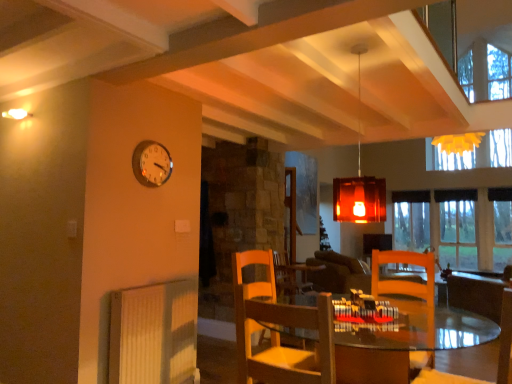
Measure the distance between wooden chair at center, the first chair positioned from the left, and camera.

A distance of 4.96 feet exists between wooden chair at center, the first chair positioned from the left, and camera.

Describe the element at coordinates (151, 163) in the screenshot. I see `white glossy clock at upper left` at that location.

Image resolution: width=512 pixels, height=384 pixels. Describe the element at coordinates (154, 334) in the screenshot. I see `white ribbed radiator at lower left` at that location.

You are a GUI agent. You are given a task and a screenshot of the screen. Output one action in this format:
    pyautogui.click(x=<x>, y=<y>)
    Task: Click on the wooden chair at center, the first chair positioned from the left
    This screenshot has height=384, width=512.
    Given the screenshot: What is the action you would take?
    pyautogui.click(x=278, y=332)

Considering the positions of point (254, 373) and point (339, 264), is point (254, 373) closer or farther from the camera than point (339, 264)?

Point (254, 373) is positioned closer to the camera compared to point (339, 264).

From a real-world perspective, is wooden chair at center, the first chair positioned from the left, physically located above or below dark brown leather couch at center?

Clearly, from a real-world perspective, wooden chair at center, the first chair positioned from the left, is above dark brown leather couch at center.

Is wooden chair at center, the first chair positioned from the left, oriented away from dark brown leather couch at center?

No, wooden chair at center, the first chair positioned from the left,'s orientation is not away from dark brown leather couch at center.

Does wooden chair at center, the 2th chair positioned from the right, have a smaller size compared to dark brown leather couch at center?

Indeed, wooden chair at center, the 2th chair positioned from the right, has a smaller size compared to dark brown leather couch at center.

Is wooden table at center smaller than dark brown leather couch at center?

Indeed, wooden table at center has a smaller size compared to dark brown leather couch at center.

From the image's perspective, is wooden table at center over dark brown leather couch at center?

Yes.

From a real-world perspective, who is located lower, wooden table at center or dark brown leather couch at center?

In real-world perspective, dark brown leather couch at center is lower.

Locate an element on the screen. the 1st chair in front of the translucent amber glass pendant light at center is located at coordinates (498, 358).

How many degrees apart are the facing directions of wooden chair at lower right, acting as the 1th chair starting from the right, and translucent amber glass pendant light at center?

87.2 degrees.

From a real-world perspective, is wooden chair at lower right, acting as the second chair starting from the left, physically below translucent amber glass pendant light at center?

Yes, from a real-world perspective, wooden chair at lower right, acting as the second chair starting from the left, is beneath translucent amber glass pendant light at center.

From the image's perspective, between wooden chair at lower right, acting as the second chair starting from the left, and translucent amber glass pendant light at center, who is located below?

wooden chair at lower right, acting as the second chair starting from the left.

Do you think dark brown leather couch at center is within wooden chair at center, the first chair positioned from the left, or outside of it?

dark brown leather couch at center is not enclosed by wooden chair at center, the first chair positioned from the left.

Can you confirm if dark brown leather couch at center is bigger than wooden chair at center, the 2th chair positioned from the right?

Yes.

Is dark brown leather couch at center oriented away from wooden chair at center, the 2th chair positioned from the right?

dark brown leather couch at center does not have its back to wooden chair at center, the 2th chair positioned from the right.

In the scene shown: Is dark brown leather couch at center far away from wooden chair at center, the 2th chair positioned from the right?

Absolutely, dark brown leather couch at center is distant from wooden chair at center, the 2th chair positioned from the right.

Where is `radiator below the white glossy clock at upper left (from a real-world perspective)`? radiator below the white glossy clock at upper left (from a real-world perspective) is located at coordinates (154, 334).

Is white glossy clock at upper left completely or partially inside white ribbed radiator at lower left?

That's incorrect, white glossy clock at upper left is not inside white ribbed radiator at lower left.

Which is more to the right, white ribbed radiator at lower left or white glossy clock at upper left?

From the viewer's perspective, white ribbed radiator at lower left appears more on the right side.

Can you confirm if white ribbed radiator at lower left is wider than white glossy clock at upper left?

Correct, the width of white ribbed radiator at lower left exceeds that of white glossy clock at upper left.

Is wooden chair at center, the first chair positioned from the left, facing towards wooden chair at lower right, acting as the second chair starting from the left?

No, wooden chair at center, the first chair positioned from the left, is not oriented towards wooden chair at lower right, acting as the second chair starting from the left.

Does point (298, 356) appear closer or farther from the camera than point (480, 382)?

Point (298, 356) appears to be closer to the viewer than point (480, 382).

Is wooden chair at center, the first chair positioned from the left, taller or shorter than wooden chair at lower right, acting as the 1th chair starting from the right?

In the image, wooden chair at center, the first chair positioned from the left, appears to be shorter than wooden chair at lower right, acting as the 1th chair starting from the right.

Can you see wooden chair at center, the first chair positioned from the left, touching wooden chair at lower right, acting as the second chair starting from the left?

No, wooden chair at center, the first chair positioned from the left, is not with wooden chair at lower right, acting as the second chair starting from the left.

This screenshot has width=512, height=384. Find the location of `radiator on the left side of clear glass window at center`. radiator on the left side of clear glass window at center is located at coordinates (154, 334).

Is clear glass window at center not close to white ribbed radiator at lower left?

clear glass window at center is far away from white ribbed radiator at lower left.

Is clear glass window at center located outside white ribbed radiator at lower left?

clear glass window at center is positioned outside white ribbed radiator at lower left.

The width and height of the screenshot is (512, 384). I want to click on couch on the right of the wooden chair at center, the 2th chair positioned from the right, so click(339, 273).

This screenshot has width=512, height=384. In order to click on table above the dark brown leather couch at center (from a real-world perspective) in this screenshot , I will do `click(406, 342)`.

Which object lies nearer to the anchor point white ribbed radiator at lower left, translucent amber glass pendant light at center or clear glass window at center?

translucent amber glass pendant light at center.

Looking at the image, which one is located further to wooden chair at center, the first chair positioned from the left, dark brown leather couch at center or white glossy clock at upper left?

dark brown leather couch at center.

When comparing their distances from white ribbed radiator at lower left, does wooden chair at lower right, acting as the 1th chair starting from the right, or clear glass window at center seem further?

Among the two, clear glass window at center is located further to white ribbed radiator at lower left.

When comparing their distances from dark brown leather couch at center, does white glossy clock at upper left or white ribbed radiator at lower left seem closer?

white ribbed radiator at lower left.

Considering their positions, is translucent amber glass pendant light at center positioned closer to wooden table at center than clear glass window at center?

clear glass window at center is positioned closer to the anchor wooden table at center.

From the image, which object appears to be nearer to clear glass window at center, wooden chair at lower right, acting as the 1th chair starting from the right, or white glossy clock at upper left?

wooden chair at lower right, acting as the 1th chair starting from the right, is closer to clear glass window at center.

When comparing their distances from wooden table at center, does translucent amber glass pendant light at center or white ribbed radiator at lower left seem further?

Among the two, translucent amber glass pendant light at center is located further to wooden table at center.

Estimate the real-world distances between objects in this image. Which object is further from wooden chair at center, the first chair positioned from the left, white ribbed radiator at lower left or clear glass window at center?

Among the two, clear glass window at center is located further to wooden chair at center, the first chair positioned from the left.

You are a GUI agent. You are given a task and a screenshot of the screen. Output one action in this format:
    pyautogui.click(x=<x>, y=<y>)
    Task: Click on the clock positioned between translucent amber glass pendant light at center and dark brown leather couch at center from near to far
    
    Given the screenshot: What is the action you would take?
    pyautogui.click(x=151, y=163)

You are a GUI agent. You are given a task and a screenshot of the screen. Output one action in this format:
    pyautogui.click(x=<x>, y=<y>)
    Task: Click on the lamp between wooden table at center and clear glass window at center along the z-axis
    The width and height of the screenshot is (512, 384).
    Given the screenshot: What is the action you would take?
    pyautogui.click(x=359, y=181)

The height and width of the screenshot is (384, 512). I want to click on radiator positioned between translucent amber glass pendant light at center and dark brown leather couch at center from near to far, so click(154, 334).

Find the location of a particular element. This screenshot has width=512, height=384. lamp between white glossy clock at upper left and wooden table at center is located at coordinates (359, 181).